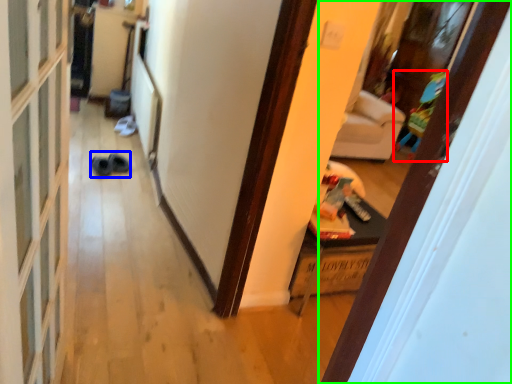
Question: Which object is the farthest from toy (highlighted by a red box)? Choose among these: shoe (highlighted by a blue box) or door (highlighted by a green box).

Choices:
 (A) shoe
 (B) door

Answer: (B)